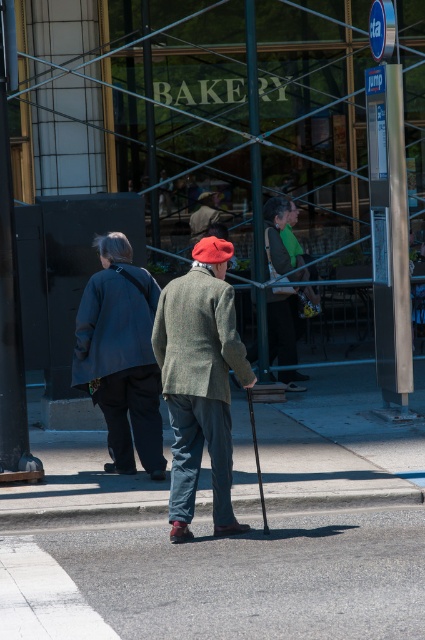
From the picture: Can you confirm if green tweed jacket at center is thinner than dark gray wool coat at center?

Yes.

Measure the distance between green tweed jacket at center and camera.

green tweed jacket at center is 8.09 meters from camera.

Locate an element on the screen. Image resolution: width=425 pixels, height=640 pixels. green tweed jacket at center is located at coordinates (200, 381).

Between point (280, 253) and point (190, 227), which one is positioned in front?

Point (280, 253) is in front.

Does matte green sweater at center have a larger size compared to matte gray jacket at center?

Yes.

The height and width of the screenshot is (640, 425). Identify the location of matte green sweater at center. (280, 328).

Describe the element at coordinates (121, 356) in the screenshot. I see `dark gray wool coat at center` at that location.

Can you confirm if dark gray wool coat at center is positioned above matte gray jacket at center?

No, dark gray wool coat at center is not above matte gray jacket at center.

This screenshot has width=425, height=640. Describe the element at coordinates (121, 356) in the screenshot. I see `dark gray wool coat at center` at that location.

Identify the location of dark gray wool coat at center. This screenshot has width=425, height=640. tap(121, 356).